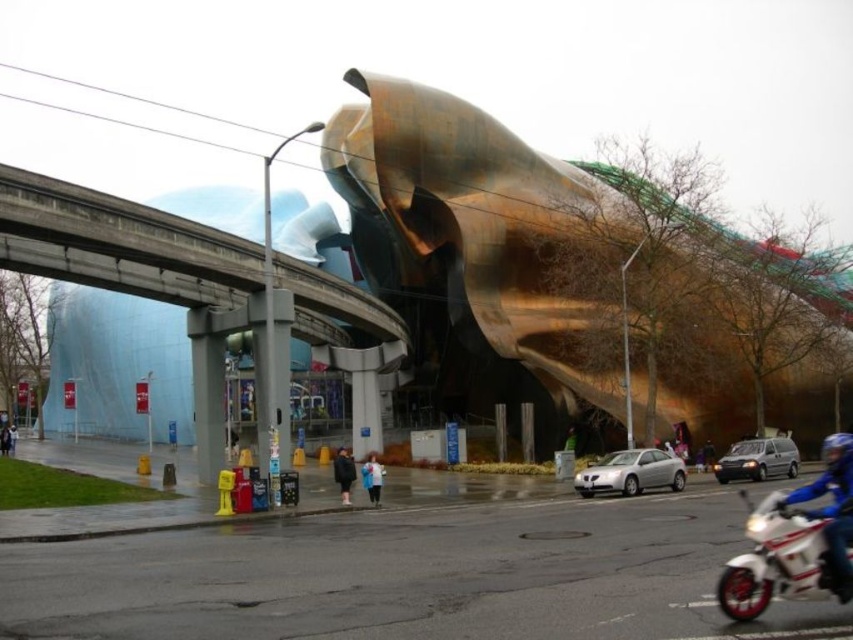
Imagine you are standing at the center of the street in front of the golden metallic building. You want to take a photo of the blue leather jacket at lower right without any obstructions. Which direction should you move to ensure the jacket is fully visible in your camera frame?

Since the blue leather jacket at lower right is located at point [833,508] in the image, you should move to the left to ensure it is fully visible without obstructions from the building or other objects.

You are a fashion photographer observing the scene. You see the blue leather jacket at lower right and the blue fabric jacket at center. Which jacket is positioned farther to the right side of the image?

The blue leather jacket at lower right is positioned farther to the right side of the image than the blue fabric jacket at center.